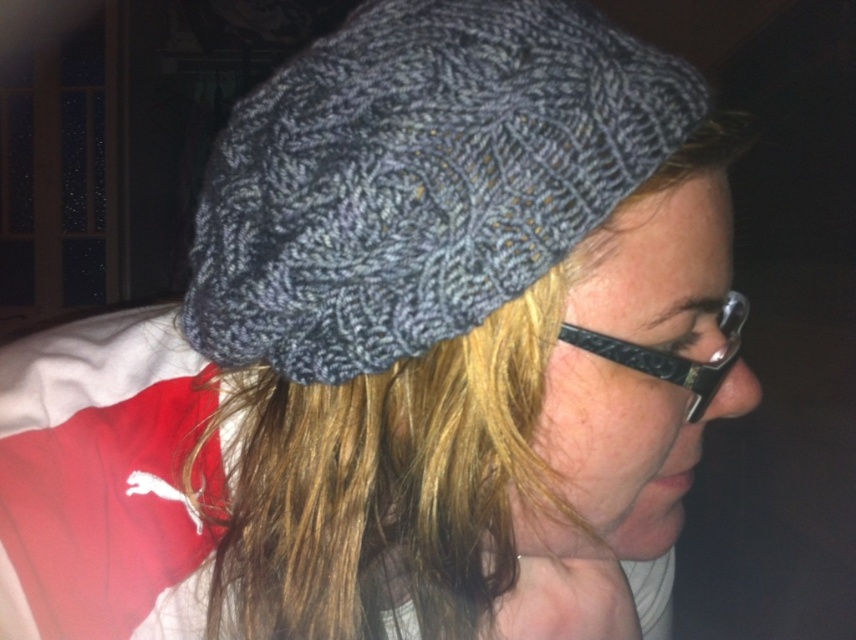
You are taking a photo of two points in a scene. The first point is at coordinates point (428, 68) and the second point is at point (735, 307). Based on the image, which point is closer to the camera?

Point (428, 68) is in front of point (735, 307), so it is closer to the camera.

You are a photographer adjusting your camera settings to focus on the knitted gray hat at upper center and the black textured glasses at center. Which object should you adjust the focus for first if you want to ensure both are sharp, considering their positions?

You should focus on the knitted gray hat at upper center first because it is closer to the viewer than the black textured glasses at center. Adjusting focus starting from the closer object ensures proper depth of field for both.

You are a photographer adjusting the lighting for a portrait. You notice the knitted gray hat at upper center and the black textured glasses at center. Which object should you focus on first to ensure proper lighting since it is positioned higher?

The knitted gray hat at upper center should be focused on first because it is located above the black textured glasses at center, making it higher in the frame.